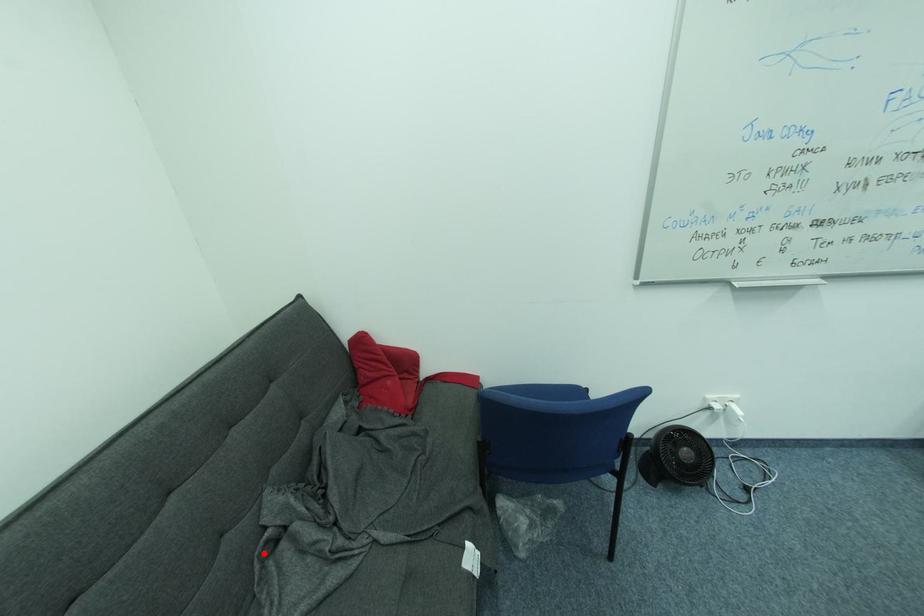
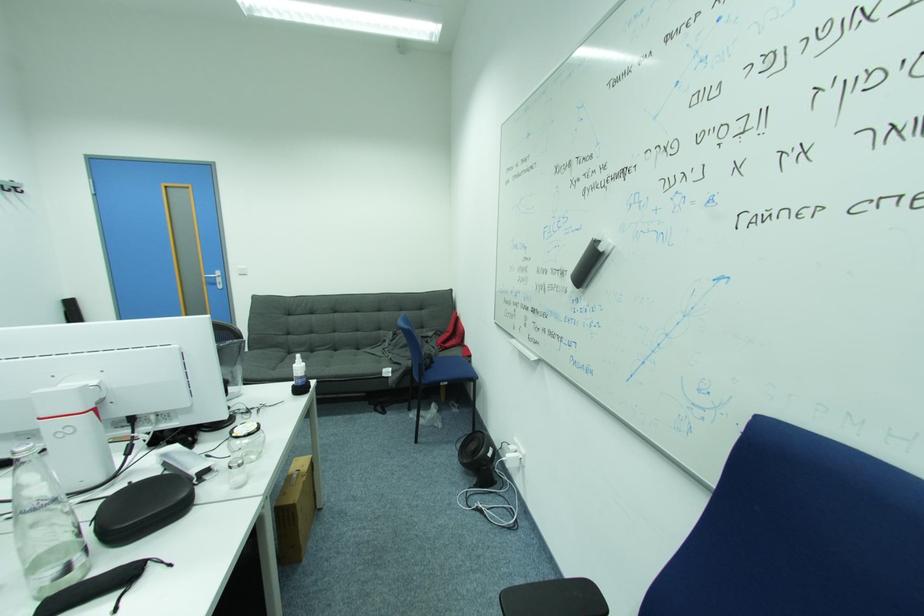
Where in the second image is the point corresponding to the highlighted location from the first image?

(388, 341)